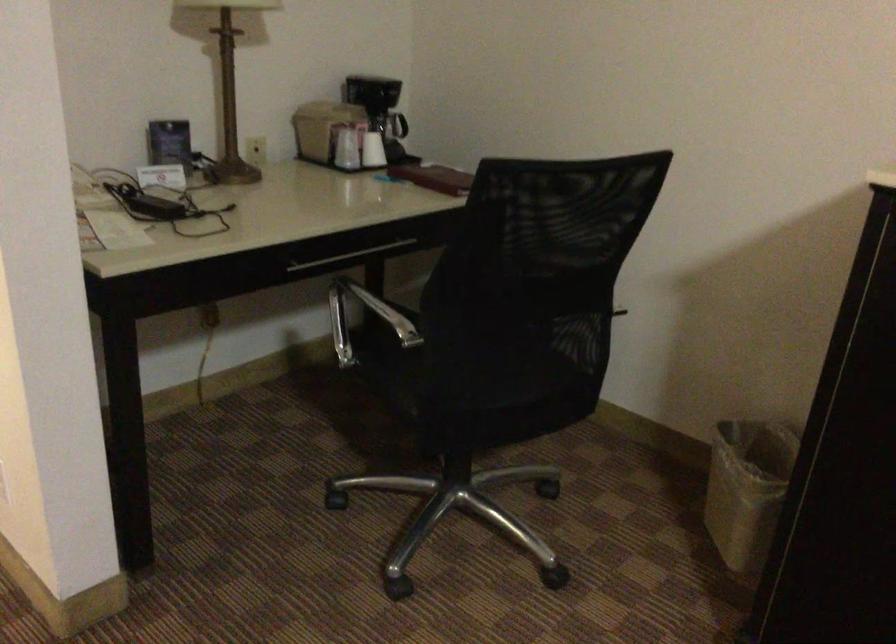
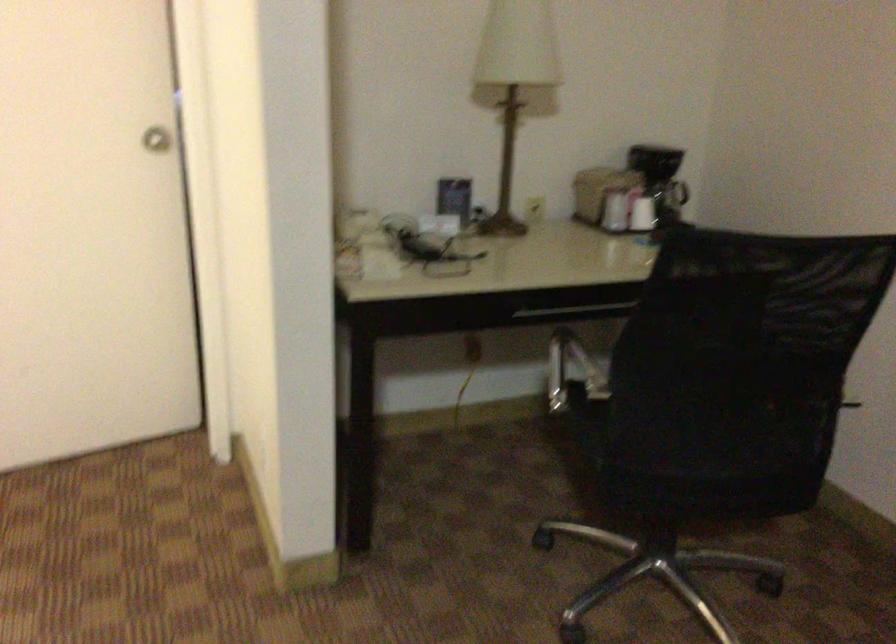
Question: Based on the continuous images, in which direction is the camera rotating? Reply with the corresponding letter.

Choices:
 (A) Left
 (B) Right
 (C) Up
 (D) Down

Answer: (A)